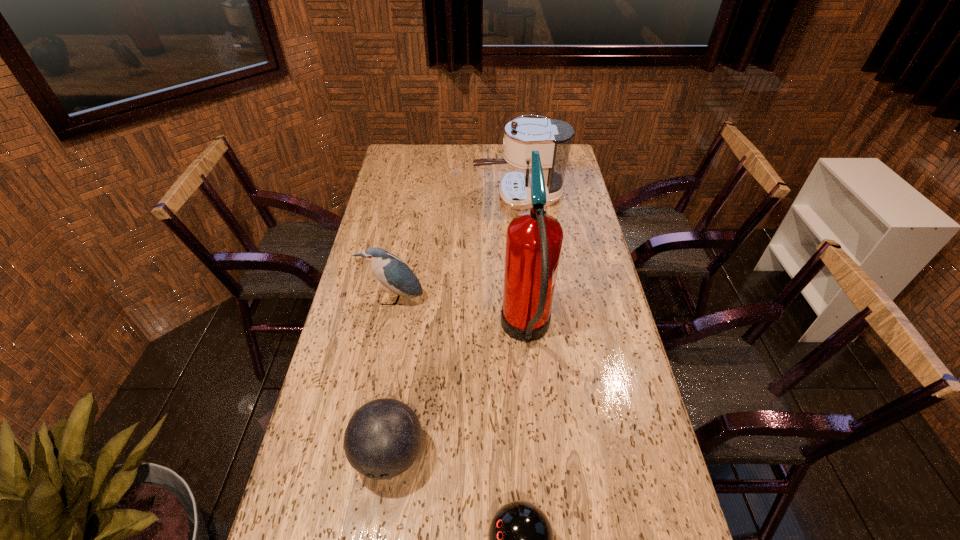
Where is `free space that satisfies the following two spatial constraints: 1. on the front-facing side of the farthest object; 2. on the front side of the fire extinguisher`? This screenshot has height=540, width=960. free space that satisfies the following two spatial constraints: 1. on the front-facing side of the farthest object; 2. on the front side of the fire extinguisher is located at coordinates (534, 333).

Where is `vacant space that satisfies the following two spatial constraints: 1. on the front-facing side of the second tallest object; 2. at the tip of the third tallest object's beak`? vacant space that satisfies the following two spatial constraints: 1. on the front-facing side of the second tallest object; 2. at the tip of the third tallest object's beak is located at coordinates (530, 300).

What are the coordinates of `vacant space that satisfies the following two spatial constraints: 1. on the front-facing side of the coffee maker; 2. on the grip area of the fourth farthest object` in the screenshot? It's located at (546, 455).

The height and width of the screenshot is (540, 960). What are the coordinates of `free point that satisfies the following two spatial constraints: 1. on the front-facing side of the farthest object; 2. on the front side of the fire extinguisher` in the screenshot? It's located at (534, 333).